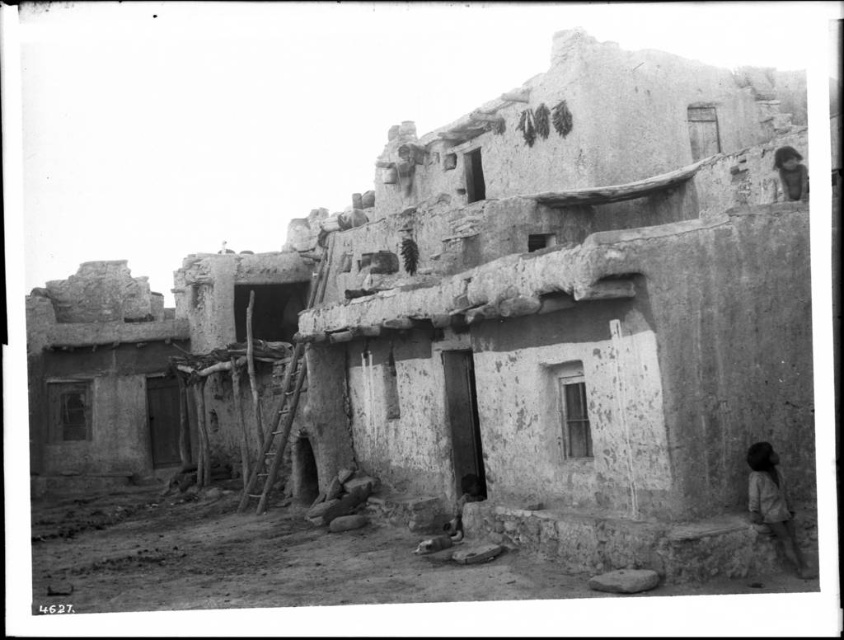
You are standing at the entrance of the adobe building and see two points marked on the wall. The first point is at coordinates point (x=127, y=396) and the second is at point (x=250, y=477). Which point is closer to you?

Point (x=250, y=477) is closer to you because it is in front of point (x=127, y=396).

You are an anthropologist examining the traditional adobe building. You notice a wooden rustic ladder at center and a dark brown leather hat at upper right. Which object is wider?

The wooden rustic ladder at center is wider than the dark brown leather hat at upper right.

You are an anthropologist visiting this traditional adobe building. You need to retrieve the dark brown leather hat at upper right but there is a wooden rustic ladder at center in the way. Can you move the ladder to access the hat?

The wooden rustic ladder at center is located below the dark brown leather hat at upper right, so you can move the ladder to access the hat since it is positioned lower than the hat.